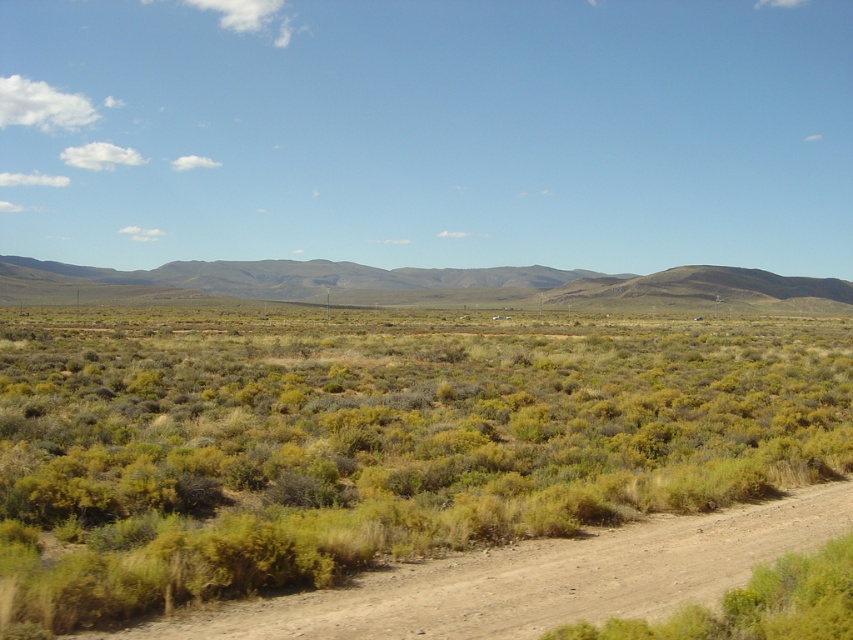
Question: Can you confirm if green shrubbery at center is positioned to the right of brown/dry grassy at center?

Choices:
 (A) yes
 (B) no

Answer: (A)

Question: Which object is closer to the camera taking this photo?

Choices:
 (A) brown/dry grassy at center
 (B) brown dirt track at lower center
 (C) green shrubbery at center

Answer: (B)

Question: Can you confirm if green shrubbery at center is positioned to the right of brown/dry grassy at center?

Choices:
 (A) no
 (B) yes

Answer: (B)

Question: Estimate the real-world distances between objects in this image. Which object is farther from the brown dirt track at lower center?

Choices:
 (A) green shrubbery at center
 (B) brown/dry grassy at center

Answer: (B)

Question: Considering the relative positions of green shrubbery at center and brown dirt track at lower center in the image provided, where is green shrubbery at center located with respect to brown dirt track at lower center?

Choices:
 (A) right
 (B) left

Answer: (A)

Question: Among these objects, which one is farthest from the camera?

Choices:
 (A) brown dirt track at lower center
 (B) green shrubbery at center
 (C) brown/dry grassy at center

Answer: (C)